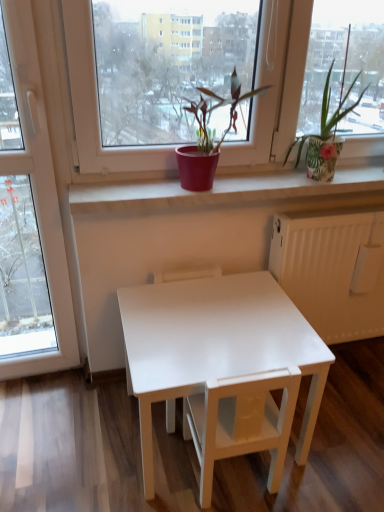
Where is `white glossy table at center, the first armchair viewed from the back`? The height and width of the screenshot is (512, 384). white glossy table at center, the first armchair viewed from the back is located at coordinates (186, 275).

The image size is (384, 512). What do you see at coordinates (208, 136) in the screenshot? I see `matte red pot at center, acting as the second houseplant starting from the right` at bounding box center [208, 136].

Image resolution: width=384 pixels, height=512 pixels. I want to click on white glossy table at center, the first armchair viewed from the back, so click(x=186, y=275).

Considering the points (351, 106) and (180, 152), which point is in front, point (351, 106) or point (180, 152)?

The point (351, 106) is more forward.

At what (x,y) coordinates should I click in order to perform the action: click on houseplant above the matte red pot at center, the 1th houseplant when ordered from left to right (from a real-world perspective). Please return your answer as a coordinate pair (x, y). Image resolution: width=384 pixels, height=512 pixels. Looking at the image, I should click on (327, 113).

Which of these two, green leafy plant at upper right, the first houseplant positioned from the right, or matte red pot at center, the 1th houseplant when ordered from left to right, is wider?

Wider between the two is green leafy plant at upper right, the first houseplant positioned from the right.

Between green leafy plant at upper right, which ranks as the second houseplant in left-to-right order, and matte red pot at center, acting as the second houseplant starting from the right, which one is positioned behind?

green leafy plant at upper right, which ranks as the second houseplant in left-to-right order, is more distant.

Between white matte chair at center, positioned as the 1th armchair in front-to-back order, and matte red pot at center, acting as the second houseplant starting from the right, which one is positioned in front?

white matte chair at center, positioned as the 1th armchair in front-to-back order, is closer to the camera.

From the image's perspective, starting from the matte red pot at center, the 1th houseplant when ordered from left to right, which armchair is the 2nd one below? Please provide its 2D coordinates.

[(241, 422)]

Considering the sizes of objects white matte chair at center, which appears as the 2th armchair when viewed from the back, and matte red pot at center, acting as the second houseplant starting from the right, in the image provided, who is shorter, white matte chair at center, which appears as the 2th armchair when viewed from the back, or matte red pot at center, acting as the second houseplant starting from the right,?

Standing shorter between the two is matte red pot at center, acting as the second houseplant starting from the right.

Which is in front, point (235, 399) or point (233, 116)?

Positioned in front is point (235, 399).

From the image's perspective, is green leafy plant at upper right, which ranks as the second houseplant in left-to-right order, positioned above or below white matte chair at center, positioned as the 1th armchair in front-to-back order?

Clearly, from the image's perspective, green leafy plant at upper right, which ranks as the second houseplant in left-to-right order, is above white matte chair at center, positioned as the 1th armchair in front-to-back order.

Between green leafy plant at upper right, the first houseplant positioned from the right, and white matte chair at center, which appears as the 2th armchair when viewed from the back, which one appears on the left side from the viewer's perspective?

white matte chair at center, which appears as the 2th armchair when viewed from the back, is more to the left.

Which of these two, green leafy plant at upper right, which ranks as the second houseplant in left-to-right order, or white matte chair at center, positioned as the 1th armchair in front-to-back order, is bigger?

Bigger between the two is white matte chair at center, positioned as the 1th armchair in front-to-back order.

What's the angular difference between green leafy plant at upper right, which ranks as the second houseplant in left-to-right order, and white matte chair at center, positioned as the 1th armchair in front-to-back order,'s facing directions?

green leafy plant at upper right, which ranks as the second houseplant in left-to-right order, and white matte chair at center, positioned as the 1th armchair in front-to-back order, are facing 178 degrees away from each other.

Is white matte chair at center, which appears as the 2th armchair when viewed from the back, facing away from white glossy table at center, the first armchair viewed from the back?

No, white matte chair at center, which appears as the 2th armchair when viewed from the back, is not facing away from white glossy table at center, the first armchair viewed from the back.

The image size is (384, 512). Find the location of `armchair that is above the white glossy table at center, the first armchair viewed from the back (from a real-world perspective)`. armchair that is above the white glossy table at center, the first armchair viewed from the back (from a real-world perspective) is located at coordinates (241, 422).

From the image's perspective, is white matte chair at center, positioned as the 1th armchair in front-to-back order, on white glossy table at center, the 2th armchair from the front?

Incorrect, from the image's perspective, white matte chair at center, positioned as the 1th armchair in front-to-back order, is lower than white glossy table at center, the 2th armchair from the front.

Could you measure the distance between matte red pot at center, acting as the second houseplant starting from the right, and white glossy table at center, the first armchair viewed from the back?

matte red pot at center, acting as the second houseplant starting from the right, is 20.00 inches away from white glossy table at center, the first armchair viewed from the back.

Considering the relative positions of matte red pot at center, the 1th houseplant when ordered from left to right, and white glossy table at center, the 2th armchair from the front, in the image provided, is matte red pot at center, the 1th houseplant when ordered from left to right, to the left or to the right of white glossy table at center, the 2th armchair from the front,?

Clearly, matte red pot at center, the 1th houseplant when ordered from left to right, is on the right of white glossy table at center, the 2th armchair from the front, in the image.

Identify the location of the 1st houseplant above the white glossy table at center, the 2th armchair from the front (from the image's perspective). The height and width of the screenshot is (512, 384). (208, 136).

Which object is thinner, white glossy table at center, the 2th armchair from the front, or matte red pot at center, acting as the second houseplant starting from the right?

matte red pot at center, acting as the second houseplant starting from the right, is thinner.

Does point (204, 273) come farther from viewer compared to point (212, 137)?

That is True.

From the picture: Considering the positions of objects white glossy table at center, the first armchair viewed from the back, and matte red pot at center, the 1th houseplant when ordered from left to right, in the image provided, who is more to the left, white glossy table at center, the first armchair viewed from the back, or matte red pot at center, the 1th houseplant when ordered from left to right,?

From the viewer's perspective, white glossy table at center, the first armchair viewed from the back, appears more on the left side.

How far apart are matte red pot at center, the 1th houseplant when ordered from left to right, and white matte chair at center, positioned as the 1th armchair in front-to-back order?

matte red pot at center, the 1th houseplant when ordered from left to right, is 30.32 inches away from white matte chair at center, positioned as the 1th armchair in front-to-back order.

Considering the relative sizes of matte red pot at center, acting as the second houseplant starting from the right, and white matte chair at center, positioned as the 1th armchair in front-to-back order, in the image provided, is matte red pot at center, acting as the second houseplant starting from the right, taller than white matte chair at center, positioned as the 1th armchair in front-to-back order,?

Incorrect, the height of matte red pot at center, acting as the second houseplant starting from the right, is not larger of that of white matte chair at center, positioned as the 1th armchair in front-to-back order.

There is a matte red pot at center, acting as the second houseplant starting from the right. Where is `the 1st armchair below it (from a real-world perspective)`? Image resolution: width=384 pixels, height=512 pixels. the 1st armchair below it (from a real-world perspective) is located at coordinates (241, 422).

From a real-world perspective, relative to white matte chair at center, positioned as the 1th armchair in front-to-back order, is matte red pot at center, the 1th houseplant when ordered from left to right, vertically above or below?

Clearly, from a real-world perspective, matte red pot at center, the 1th houseplant when ordered from left to right, is above white matte chair at center, positioned as the 1th armchair in front-to-back order.

What are the coordinates of `houseplant that appears in front of the green leafy plant at upper right, the first houseplant positioned from the right` in the screenshot? It's located at (208, 136).

The width and height of the screenshot is (384, 512). I want to click on the 2nd armchair below the matte red pot at center, acting as the second houseplant starting from the right (from the image's perspective), so click(241, 422).

Looking at the image, which one is located closer to white matte chair at center, positioned as the 1th armchair in front-to-back order, white glossy table at center, the 2th armchair from the front, or green leafy plant at upper right, the first houseplant positioned from the right?

white glossy table at center, the 2th armchair from the front, is closer to white matte chair at center, positioned as the 1th armchair in front-to-back order.

Estimate the real-world distances between objects in this image. Which object is further from green leafy plant at upper right, the first houseplant positioned from the right, white matte chair at center, which appears as the 2th armchair when viewed from the back, or white glossy table at center?

white matte chair at center, which appears as the 2th armchair when viewed from the back, is positioned further to the anchor green leafy plant at upper right, the first houseplant positioned from the right.

When comparing their distances from white glossy table at center, does white matte chair at center, which appears as the 2th armchair when viewed from the back, or white glossy table at center, the first armchair viewed from the back, seem closer?

white matte chair at center, which appears as the 2th armchair when viewed from the back, is positioned closer to the anchor white glossy table at center.

Estimate the real-world distances between objects in this image. Which object is closer to matte red pot at center, acting as the second houseplant starting from the right, white glossy table at center, the 2th armchair from the front, or green leafy plant at upper right, the first houseplant positioned from the right?

green leafy plant at upper right, the first houseplant positioned from the right, lies closer to matte red pot at center, acting as the second houseplant starting from the right, than the other object.

Estimate the real-world distances between objects in this image. Which object is further from white glossy table at center, white matte chair at center, positioned as the 1th armchair in front-to-back order, or green leafy plant at upper right, the first houseplant positioned from the right?

green leafy plant at upper right, the first houseplant positioned from the right, lies further to white glossy table at center than the other object.

Based on their spatial positions, is green leafy plant at upper right, the first houseplant positioned from the right, or white glossy table at center further from white glossy table at center, the first armchair viewed from the back?

green leafy plant at upper right, the first houseplant positioned from the right, is positioned further to the anchor white glossy table at center, the first armchair viewed from the back.

Looking at the image, which one is located closer to matte red pot at center, acting as the second houseplant starting from the right, white matte chair at center, positioned as the 1th armchair in front-to-back order, or white glossy table at center, the 2th armchair from the front?

Among the two, white glossy table at center, the 2th armchair from the front, is located nearer to matte red pot at center, acting as the second houseplant starting from the right.

When comparing their distances from matte red pot at center, acting as the second houseplant starting from the right, does green leafy plant at upper right, the first houseplant positioned from the right, or white glossy table at center seem further?

Result: white glossy table at center.

The width and height of the screenshot is (384, 512). In order to click on houseplant between green leafy plant at upper right, the first houseplant positioned from the right, and white matte chair at center, positioned as the 1th armchair in front-to-back order, from top to bottom in this screenshot , I will do `click(208, 136)`.

What are the coordinates of `houseplant between green leafy plant at upper right, the first houseplant positioned from the right, and white glossy table at center, the first armchair viewed from the back, from top to bottom` in the screenshot? It's located at (208, 136).

The image size is (384, 512). I want to click on armchair that lies between green leafy plant at upper right, the first houseplant positioned from the right, and white matte chair at center, positioned as the 1th armchair in front-to-back order, from top to bottom, so click(x=186, y=275).

This screenshot has height=512, width=384. I want to click on armchair between matte red pot at center, acting as the second houseplant starting from the right, and white matte chair at center, positioned as the 1th armchair in front-to-back order, from top to bottom, so click(186, 275).